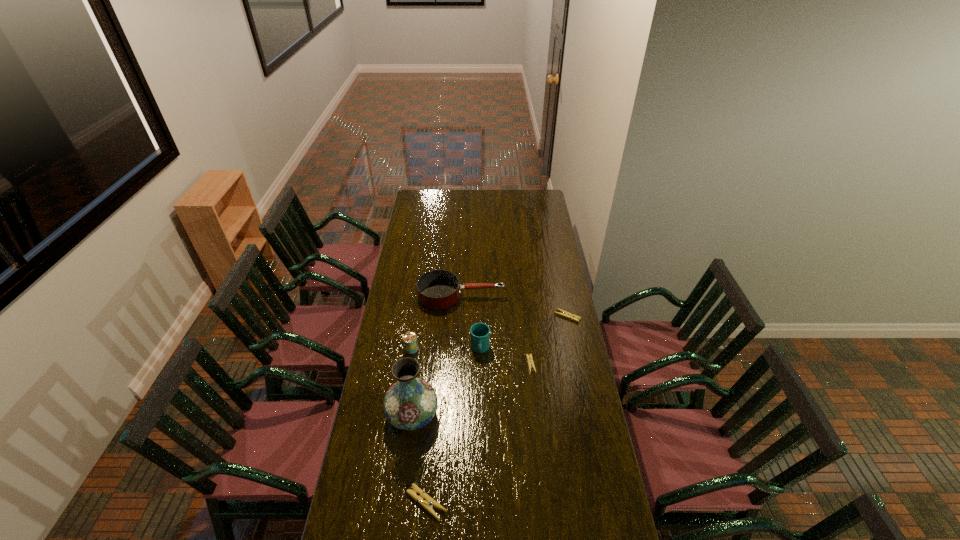
At what (x,y) coordinates should I click in order to perform the action: click on vase that is positioned at the left edge. Please return your answer as a coordinate pair (x, y). This screenshot has width=960, height=540. Looking at the image, I should click on (410, 403).

The image size is (960, 540). I want to click on can that is at the left edge, so click(410, 342).

Find the location of a particular element. This screenshot has width=960, height=540. object that is at the right edge is located at coordinates (563, 313).

The width and height of the screenshot is (960, 540). Find the location of `vacant space at the near edge of the desktop`. vacant space at the near edge of the desktop is located at coordinates (545, 523).

You are a GUI agent. You are given a task and a screenshot of the screen. Output one action in this format:
    pyautogui.click(x=<x>, y=<y>)
    Task: Click on the vacant space at the left edge of the desktop
    This screenshot has height=540, width=960.
    Given the screenshot: What is the action you would take?
    pyautogui.click(x=411, y=280)

In the image, there is a desktop. What are the coordinates of `free space at the right edge` in the screenshot? It's located at (578, 334).

Where is `vacant position at the far right corner of the desktop`? Image resolution: width=960 pixels, height=540 pixels. vacant position at the far right corner of the desktop is located at coordinates (535, 192).

Locate an element on the screen. The image size is (960, 540). empty space that is in between the second shortest clothespin and the pan is located at coordinates (515, 306).

What are the coordinates of `vacant space that is in between the vase and the fifth tallest object` in the screenshot? It's located at (420, 459).

In order to click on vacant space that is in between the vase and the nearest object in this screenshot , I will do `click(420, 459)`.